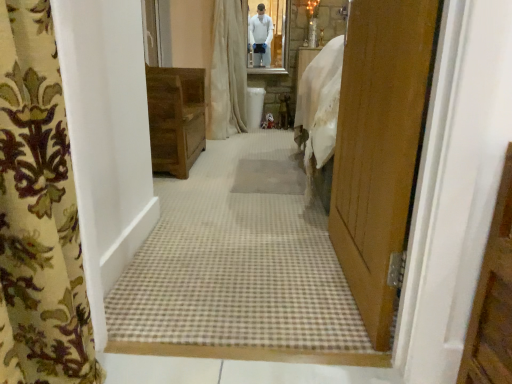
Question: In the image, is floral fabric curtain at left, marked as the first curtain in a bottom-to-top arrangement, positioned in front of or behind wooden cabinet at center?

Choices:
 (A) behind
 (B) front

Answer: (B)

Question: In terms of width, does floral fabric curtain at left, arranged as the first curtain when viewed from the front, look wider or thinner when compared to wooden cabinet at center?

Choices:
 (A) wide
 (B) thin

Answer: (B)

Question: Based on their relative distances, which object is farther from the beige fabric curtain at center, which is the second curtain in bottom-to-top order?

Choices:
 (A) beige carpet at center
 (B) wooden door at right
 (C) beige textured mat at center
 (D) floral fabric curtain at left, the second curtain viewed from the top
 (E) wooden cabinet at center

Answer: (D)

Question: Which is farther from the wooden door at right?

Choices:
 (A) beige fabric curtain at center, which is the second curtain in bottom-to-top order
 (B) floral fabric curtain at left, arranged as the first curtain when viewed from the front
 (C) beige carpet at center
 (D) beige textured mat at center
 (E) wooden cabinet at center

Answer: (A)